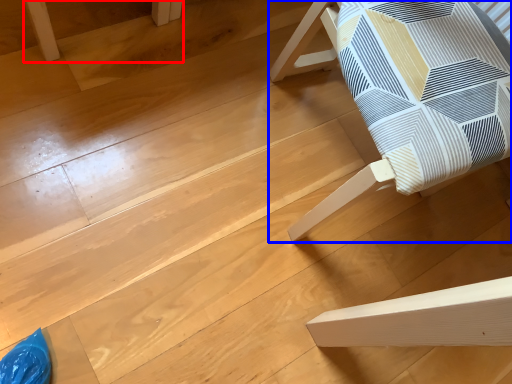
Question: Among these objects, which one is nearest to the camera, furniture (highlighted by a red box) or furniture (highlighted by a blue box)?

Choices:
 (A) furniture
 (B) furniture

Answer: (B)